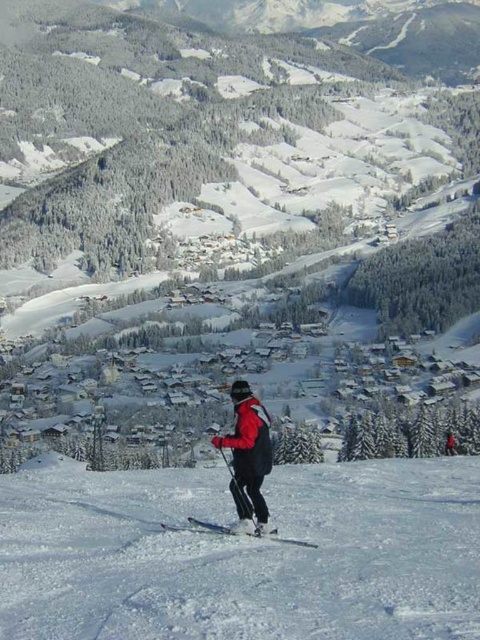
Consider the image. You are a drone operator tasked with capturing aerial footage of the red matte jacket at center and the white snow ski slope at center. Your drone has a maximum range of 10 meters. Can your drone safely capture footage of both objects without exceeding its range limit?

The distance between the white snow ski slope at center and the red matte jacket at center is 10.61 meters. Since the drone has a maximum range of 10 meters, it cannot safely capture footage of both objects without exceeding its range limit.

You are a skier planning your descent down the slope. You notice the white snow ski slope at center and the white plastic ski at center in your path. Which object will you encounter first while skiing down?

The white plastic ski at center will be encountered first because it is positioned above the white snow ski slope at center, which is located below it according to the description.

You are a drone operator trying to capture the skier in the image. The drone is currently at point (242, 554). Where should you move the drone to get a clear view of the skier?

The point (242, 554) is located on the white snow ski slope at center. To capture the skier, move the drone to a higher elevation above the slope to get a clear view of the skier.